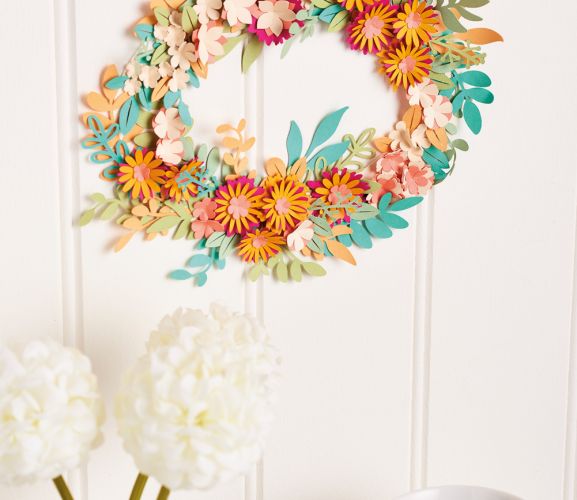
Image resolution: width=577 pixels, height=500 pixels. I want to click on art, so click(421, 142), click(319, 201), click(131, 138).